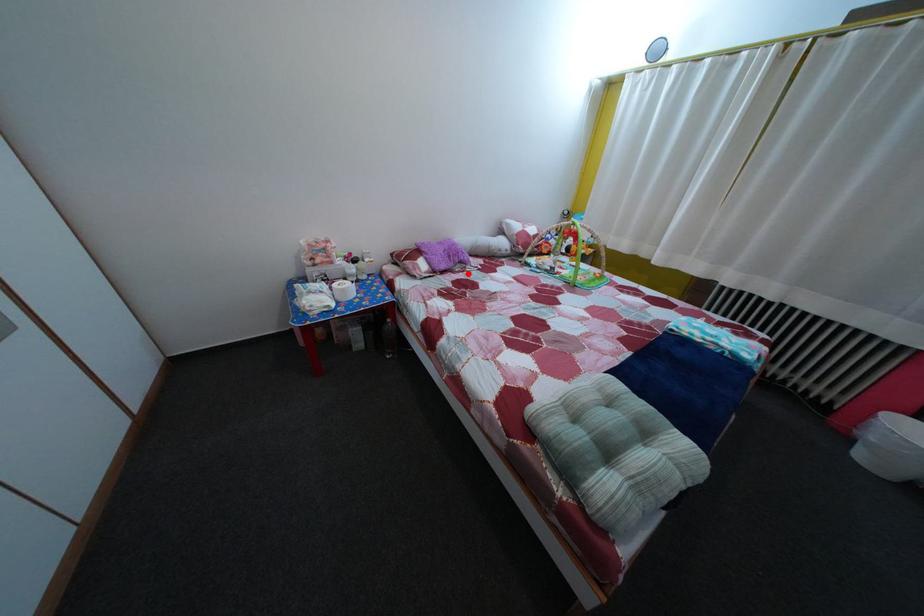
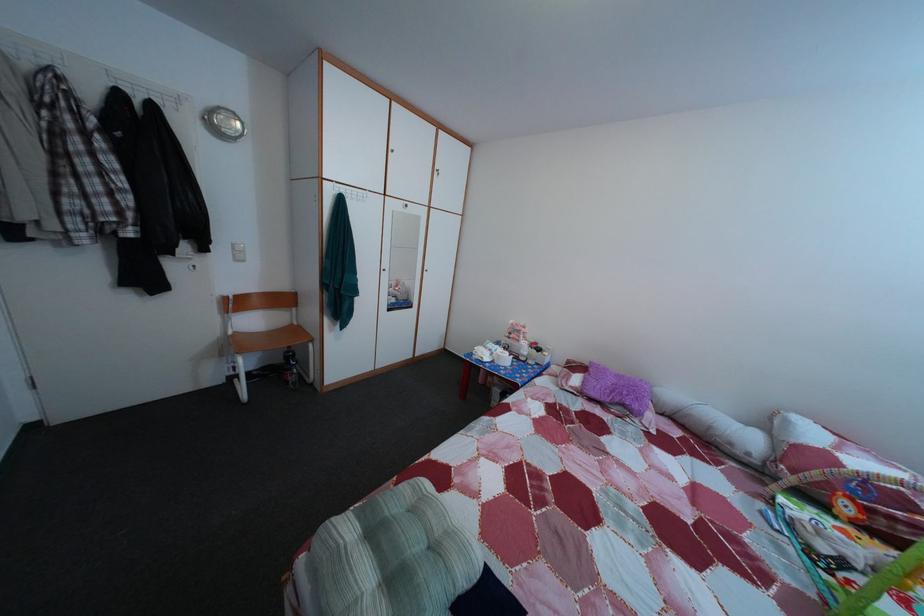
Locate, in the second image, the point that corresponds to the highlighted location in the first image.

(628, 416)